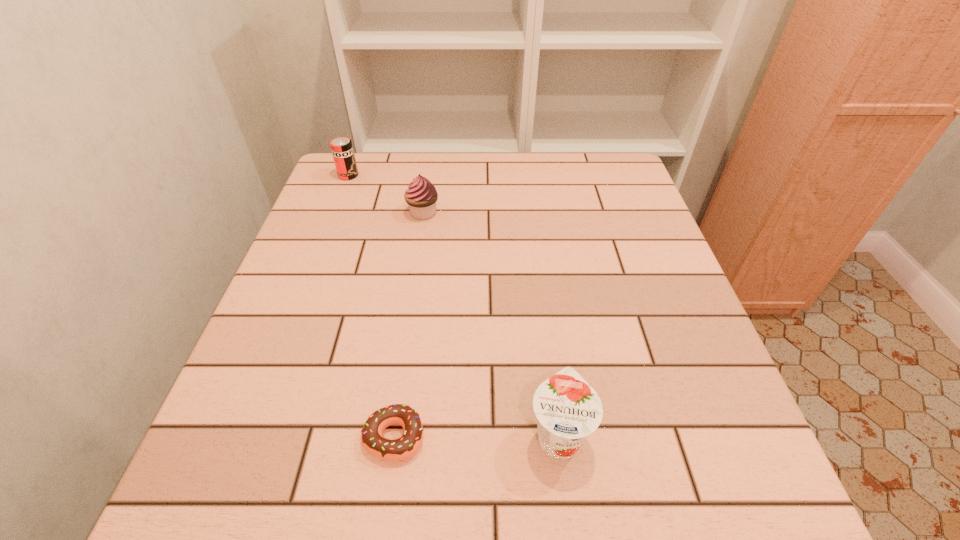
Identify the location of vacant area that satisfies the following two spatial constraints: 1. on the front side of the farthest object; 2. on the left side of the shortest object. The width and height of the screenshot is (960, 540). (248, 437).

At what (x,y) coordinates should I click in order to perform the action: click on free location that satisfies the following two spatial constraints: 1. on the front side of the leftmost object; 2. on the right side of the cupcake. Please return your answer as a coordinate pair (x, y). The width and height of the screenshot is (960, 540). Looking at the image, I should click on (334, 213).

At what (x,y) coordinates should I click in order to perform the action: click on vacant area that satisfies the following two spatial constraints: 1. on the front side of the third nearest object; 2. on the right side of the can. Please return your answer as a coordinate pair (x, y). This screenshot has height=540, width=960. Looking at the image, I should click on (334, 213).